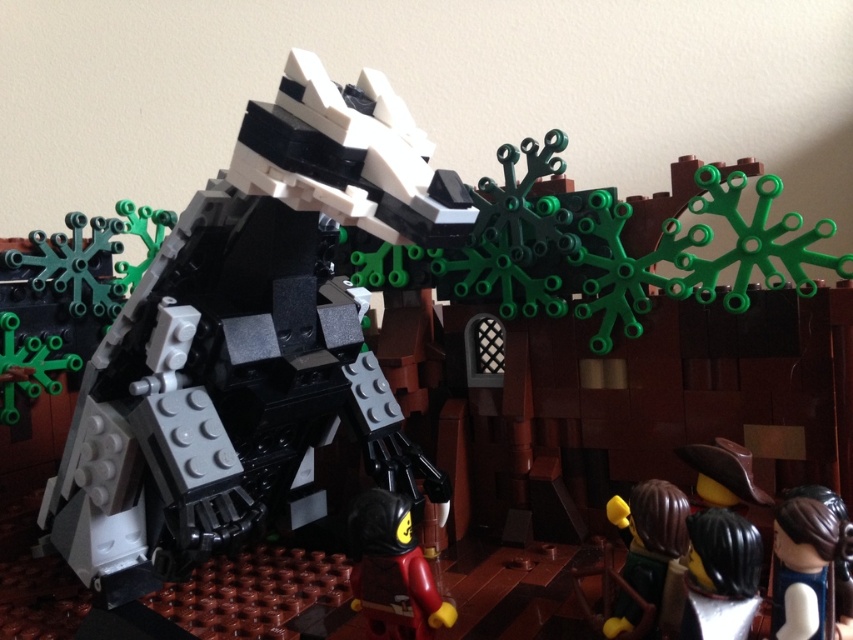
Where is `smooth red minifigure at center`? smooth red minifigure at center is located at coordinates (392, 570).

Is smooth red minifigure at center shorter than black glossy hair at lower right?

In fact, smooth red minifigure at center may be taller than black glossy hair at lower right.

I want to click on smooth red minifigure at center, so click(392, 570).

Between smooth red minifigure at center and smooth brown hair at lower right, which one appears on the right side from the viewer's perspective?

smooth brown hair at lower right is more to the right.

Is smooth red minifigure at center above smooth brown hair at lower right?

No, smooth red minifigure at center is not above smooth brown hair at lower right.

Between point (363, 532) and point (791, 544), which one is positioned in front?

Positioned in front is point (791, 544).

Identify the location of smooth red minifigure at center. (392, 570).

Is point (816, 608) closer to camera compared to point (720, 577)?

Yes, point (816, 608) is closer to viewer.

In the scene shown: Does smooth brown hair at lower right have a greater height compared to black glossy hair at lower right?

Correct, smooth brown hair at lower right is much taller as black glossy hair at lower right.

Between point (827, 557) and point (758, 538), which one is positioned in front?

Point (827, 557) is more forward.

You are a GUI agent. You are given a task and a screenshot of the screen. Output one action in this format:
    pyautogui.click(x=<x>, y=<y>)
    Task: Click on the smooth brown hair at lower right
    Image resolution: width=853 pixels, height=640 pixels.
    Given the screenshot: What is the action you would take?
    pyautogui.click(x=805, y=566)